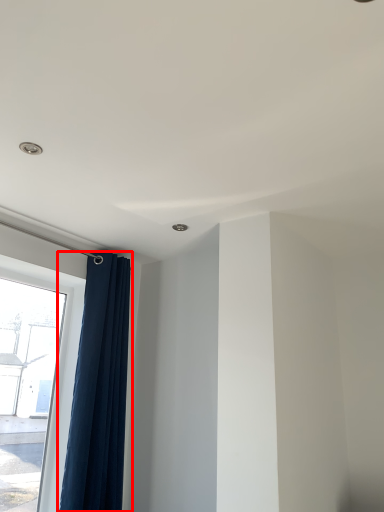
Question: Considering the relative positions of curtain (annotated by the red box) and window in the image provided, where is curtain (annotated by the red box) located with respect to the staircase?

Choices:
 (A) left
 (B) right

Answer: (B)